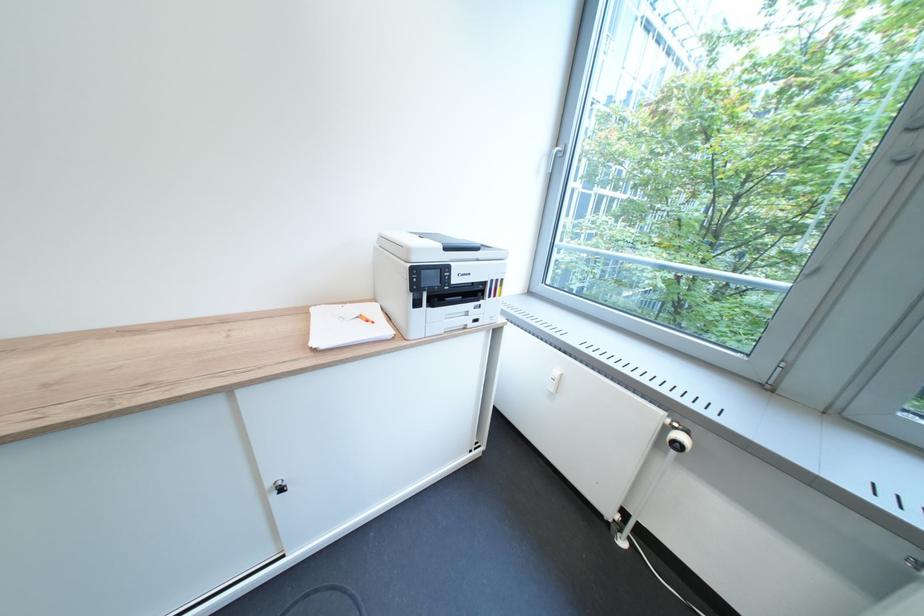
Find where to press the printer control buttons. Please return your answer as a coordinate pair (x, y).

(434, 277)